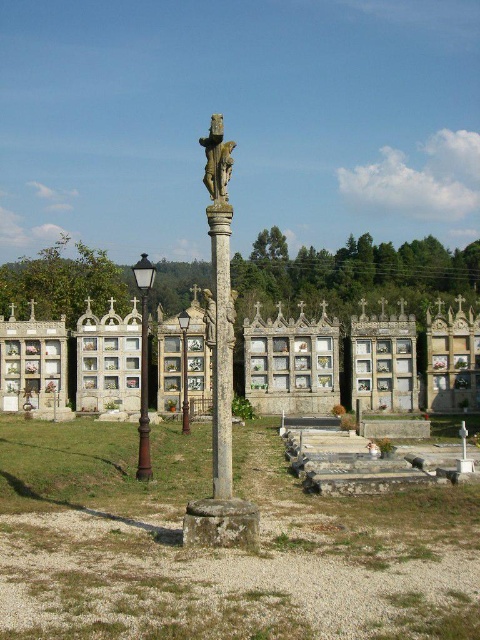
Question: Considering the real-world distances, which object is farthest from the bronze/brass streetlamp at left?

Choices:
 (A) smooth stone column at center
 (B) polished stone statue at center
 (C) metallic lamp post at center

Answer: (B)

Question: Does bronze/brass streetlamp at left have a larger size compared to polished stone statue at center?

Choices:
 (A) no
 (B) yes

Answer: (B)

Question: Which object is farther from the camera taking this photo?

Choices:
 (A) smooth stone column at center
 (B) bronze/brass streetlamp at left

Answer: (B)

Question: Estimate the real-world distances between objects in this image. Which object is closer to the bronze/brass streetlamp at left?

Choices:
 (A) polished stone statue at center
 (B) smooth stone column at center

Answer: (B)

Question: Is smooth stone column at center closer to camera compared to bronze/brass streetlamp at left?

Choices:
 (A) yes
 (B) no

Answer: (A)

Question: Is polished stone statue at center behind metallic lamp post at center?

Choices:
 (A) yes
 (B) no

Answer: (B)